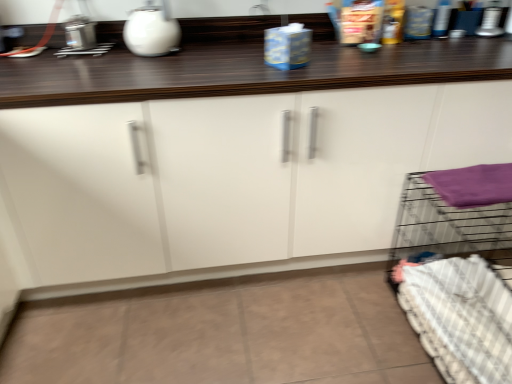
Question: Is white glossy kettle at upper center taller than white checkered bedding at lower right?

Choices:
 (A) yes
 (B) no

Answer: (B)

Question: Is white glossy kettle at upper center looking in the opposite direction of white checkered bedding at lower right?

Choices:
 (A) no
 (B) yes

Answer: (A)

Question: Considering the relative positions of white glossy kettle at upper center and white checkered bedding at lower right in the image provided, is white glossy kettle at upper center to the left of white checkered bedding at lower right from the viewer's perspective?

Choices:
 (A) yes
 (B) no

Answer: (A)

Question: From the image's perspective, is white glossy kettle at upper center over white checkered bedding at lower right?

Choices:
 (A) no
 (B) yes

Answer: (B)

Question: Is the position of white glossy kettle at upper center less distant than that of white checkered bedding at lower right?

Choices:
 (A) no
 (B) yes

Answer: (A)

Question: Is white glossy kettle at upper center oriented towards white checkered bedding at lower right?

Choices:
 (A) yes
 (B) no

Answer: (B)

Question: Is white glossy kettle at upper center aimed at purple fabric at right?

Choices:
 (A) yes
 (B) no

Answer: (B)

Question: Is white glossy kettle at upper center bigger than purple fabric at right?

Choices:
 (A) yes
 (B) no

Answer: (A)

Question: Considering the relative positions of white glossy kettle at upper center and purple fabric at right in the image provided, is white glossy kettle at upper center in front of purple fabric at right?

Choices:
 (A) yes
 (B) no

Answer: (B)

Question: Considering the relative sizes of white glossy kettle at upper center and purple fabric at right in the image provided, is white glossy kettle at upper center shorter than purple fabric at right?

Choices:
 (A) yes
 (B) no

Answer: (B)

Question: From the image's perspective, is white glossy kettle at upper center beneath purple fabric at right?

Choices:
 (A) no
 (B) yes

Answer: (A)

Question: Does white glossy kettle at upper center appear on the right side of purple fabric at right?

Choices:
 (A) no
 (B) yes

Answer: (A)

Question: Is white checkered bedding at lower right closer to the viewer compared to purple fabric at right?

Choices:
 (A) no
 (B) yes

Answer: (B)